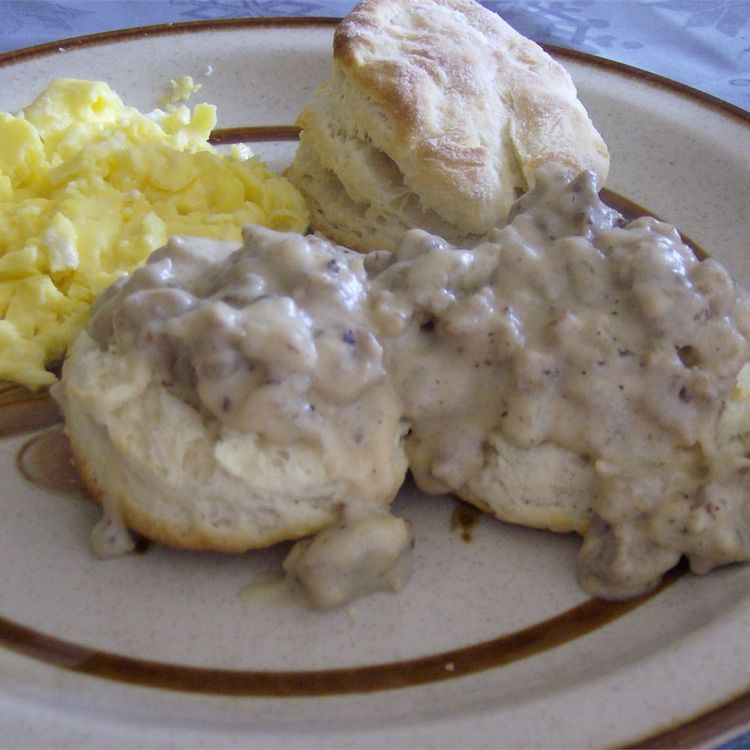
I want to click on dinner plate, so click(220, 632).